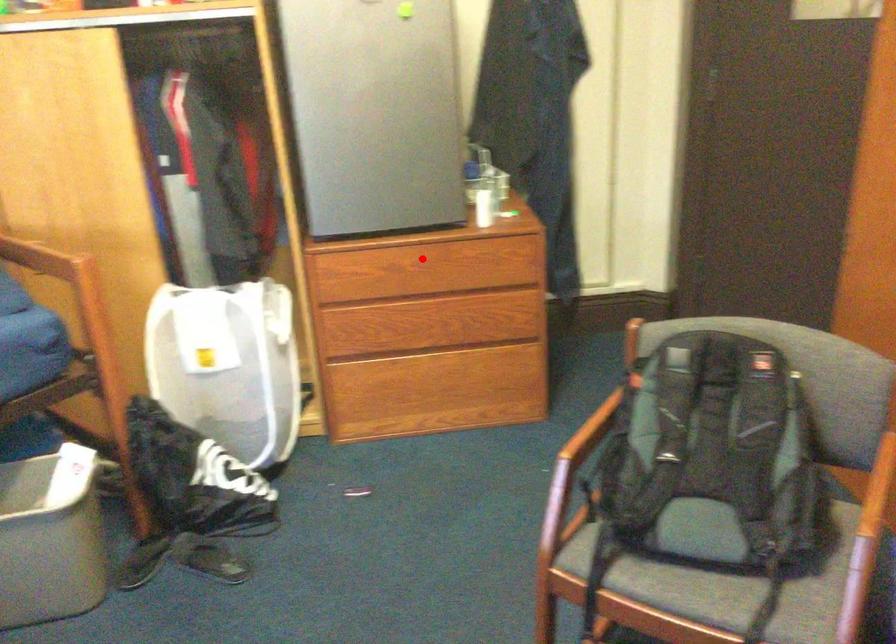
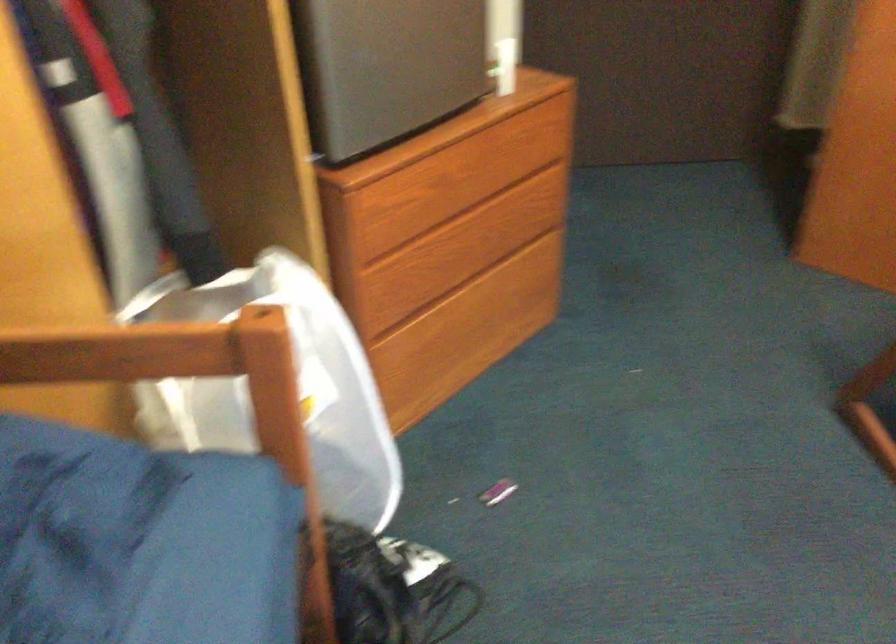
Question: I am providing you with two images of the same scene from different viewpoints. A red point is marked on the first image. At the location where the point appears in image 1, is it still visible in image 2?

Choices:
 (A) Yes
 (B) No

Answer: (A)